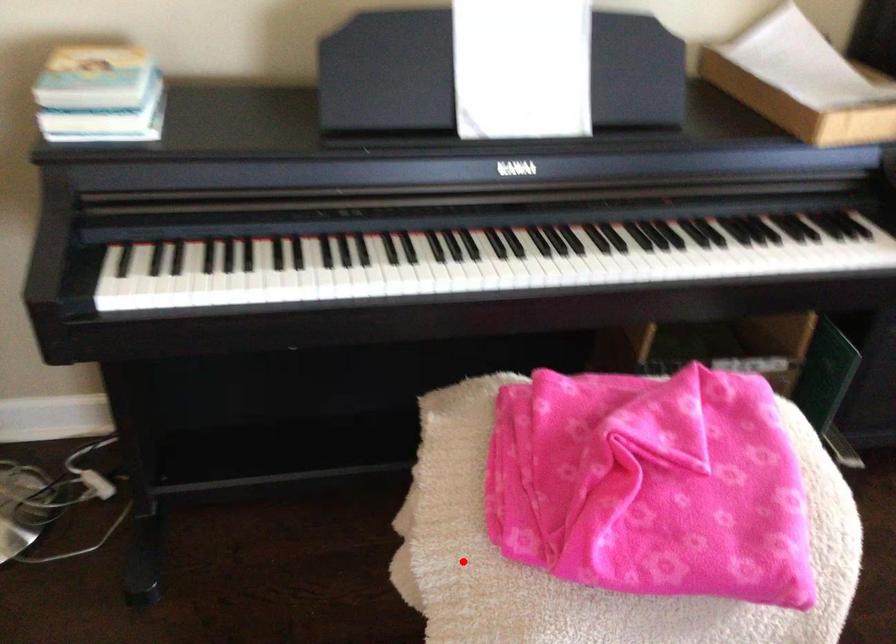
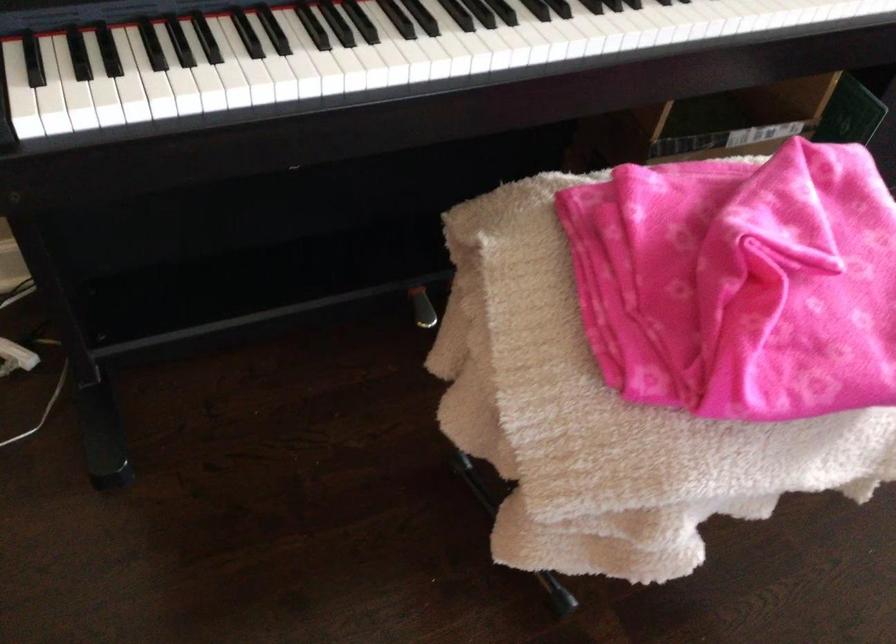
Where in the second image is the point corresponding to the highlighted location from the first image?

(571, 406)